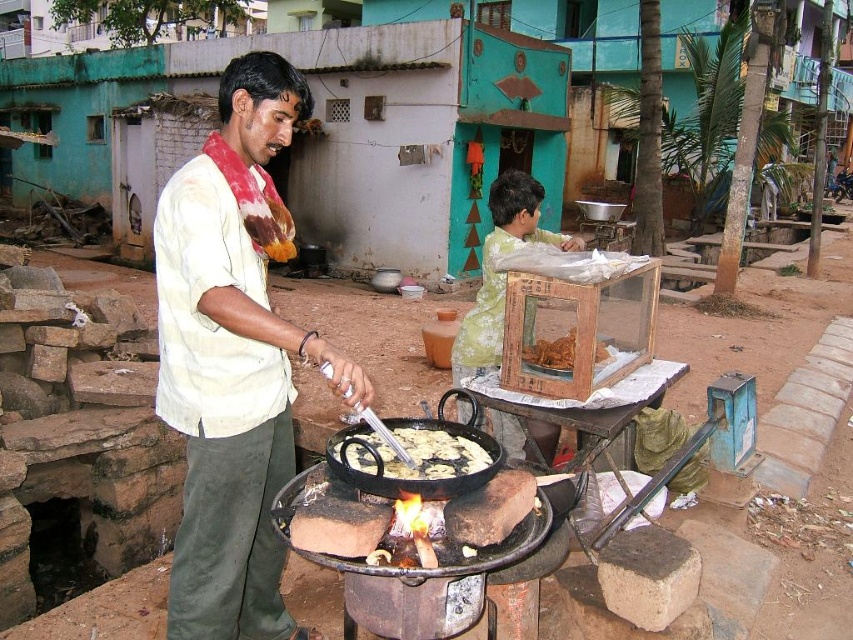
In the scene shown: Does light beige shirt at center lie behind golden crispy flatbread at center?

Yes, light beige shirt at center is behind golden crispy flatbread at center.

Which is behind, point (223, 216) or point (461, 448)?

Point (461, 448)

Where is `light beige shirt at center`? light beige shirt at center is located at coordinates (233, 356).

Between golden crispy flatbread at center and brown crispy fried food at center, which one has less height?

golden crispy flatbread at center

Does golden crispy flatbread at center have a lesser width compared to brown crispy fried food at center?

No, golden crispy flatbread at center is not thinner than brown crispy fried food at center.

Which is in front, point (376, 465) or point (564, 353)?

Point (376, 465) is more forward.

In order to click on golden crispy flatbread at center in this screenshot , I will do `click(413, 452)`.

Based on the photo, how much distance is there between light beige shirt at center and brown crispy fried food at center?

A distance of 1.34 meters exists between light beige shirt at center and brown crispy fried food at center.

Is light beige shirt at center taller than brown crispy fried food at center?

Correct, light beige shirt at center is much taller as brown crispy fried food at center.

Is point (294, 108) more distant than point (537, 358)?

No, (294, 108) is closer to viewer.

Locate an element on the screen. The width and height of the screenshot is (853, 640). light beige shirt at center is located at coordinates (x=233, y=356).